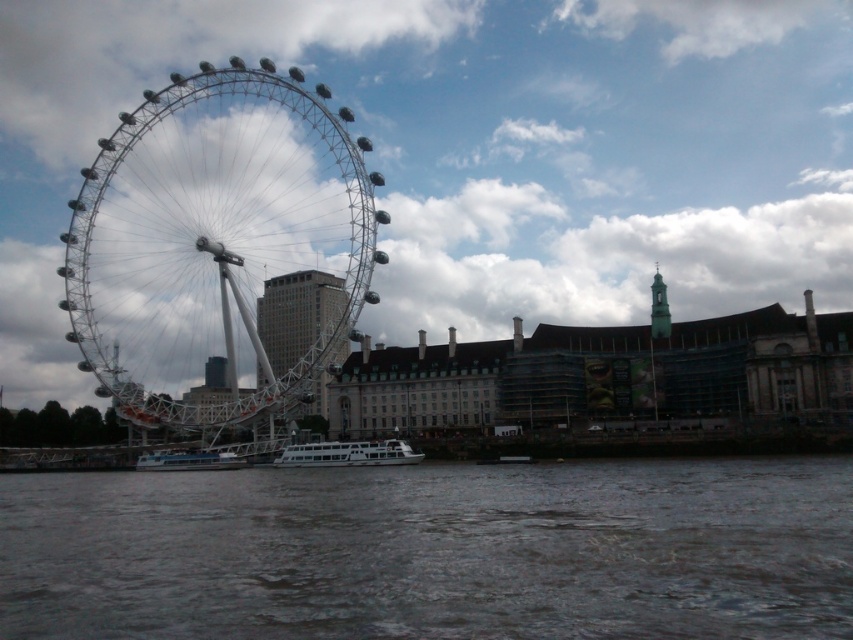
Question: Does white glossy boat at center appear on the left side of green matte tower at upper right?

Choices:
 (A) no
 (B) yes

Answer: (B)

Question: Among these points, which one is nearest to the camera?

Choices:
 (A) (206, 104)
 (B) (434, 573)
 (C) (247, 461)
 (D) (659, 300)

Answer: (B)

Question: Which point is farther from the camera taking this photo?

Choices:
 (A) (576, 563)
 (B) (173, 461)
 (C) (666, 323)
 (D) (368, 218)

Answer: (C)

Question: Considering the relative positions of white glossy boat at lower center and green matte tower at upper right in the image provided, where is white glossy boat at lower center located with respect to green matte tower at upper right?

Choices:
 (A) left
 (B) right

Answer: (A)

Question: Which of the following is the closest to the observer?

Choices:
 (A) (483, 634)
 (B) (309, 460)
 (C) (138, 320)
 (D) (144, 467)

Answer: (A)

Question: Does dark gray water at lower center come behind white metallic ferris wheel at left?

Choices:
 (A) no
 (B) yes

Answer: (A)